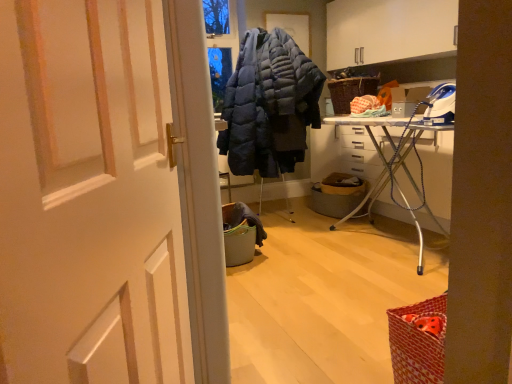
The width and height of the screenshot is (512, 384). I want to click on free space in front of dark blue quilted jacket at center, so click(303, 246).